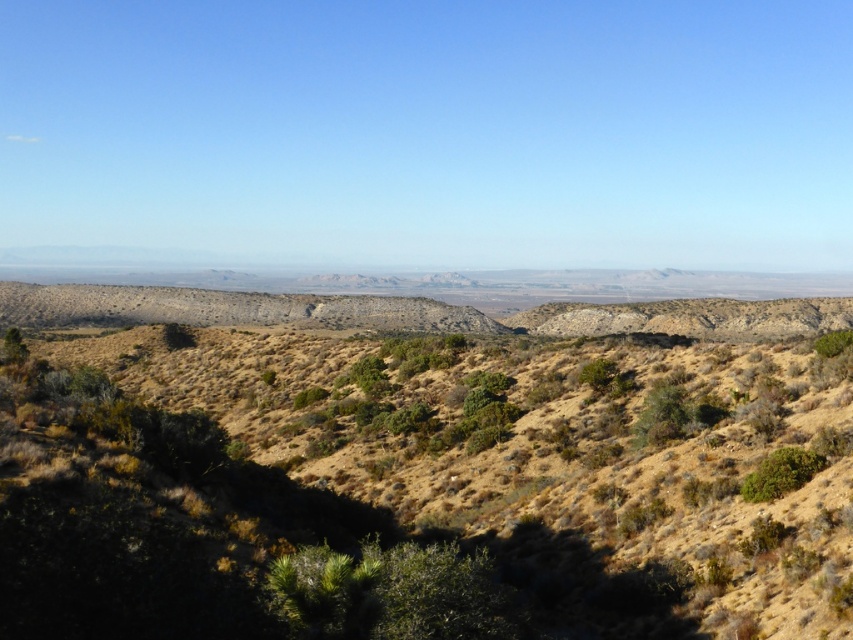
Does dry grassland at center come in front of green leafy bush at lower right?

That is True.

Who is positioned more to the left, dry grassland at center or green leafy bush at lower right?

dry grassland at center is more to the left.

Find the location of `dry grassland at center`. dry grassland at center is located at coordinates (403, 480).